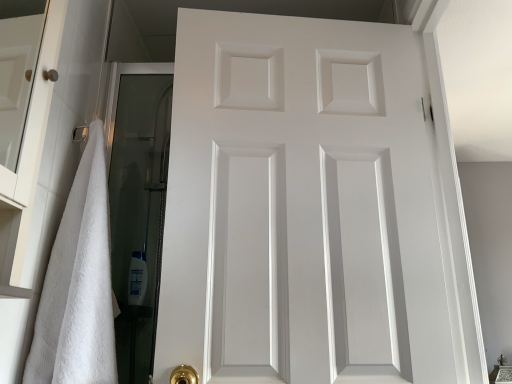
This screenshot has width=512, height=384. What do you see at coordinates (78, 285) in the screenshot?
I see `white fluffy towel at left` at bounding box center [78, 285].

Where is `white glossy shampoo bottle at lower left`? white glossy shampoo bottle at lower left is located at coordinates (137, 278).

This screenshot has height=384, width=512. What do you see at coordinates (137, 278) in the screenshot? I see `white glossy shampoo bottle at lower left` at bounding box center [137, 278].

At what (x,y) coordinates should I click in order to perform the action: click on white fluffy towel at left. Please return your answer as a coordinate pair (x, y). The image size is (512, 384). Looking at the image, I should click on (78, 285).

How many degrees apart are the facing directions of white glossy shampoo bottle at lower left and white matte door at center?

There is a 81.6-degree angle between the facing directions of white glossy shampoo bottle at lower left and white matte door at center.

How distant is white glossy shampoo bottle at lower left from white matte door at center?

white glossy shampoo bottle at lower left is 33.00 inches away from white matte door at center.

Is white glossy shampoo bottle at lower left to the left or to the right of white matte door at center in the image?

Based on their positions, white glossy shampoo bottle at lower left is located to the left of white matte door at center.

Can you confirm if white glossy shampoo bottle at lower left is shorter than white matte door at center?

Yes.

Is white fluffy towel at left facing away from white matte door at center?

No, white fluffy towel at left is not facing the opposite direction of white matte door at center.

Which object is wider, white fluffy towel at left or white matte door at center?

white fluffy towel at left is wider.

Is white fluffy towel at left smaller than white matte door at center?

Correct, white fluffy towel at left occupies less space than white matte door at center.

Find the location of a particular element. bath towel located in front of the white matte door at center is located at coordinates (78, 285).

Is white glossy shampoo bottle at lower left positioned far away from white fluffy towel at left?

No.

Considering the positions of point (133, 257) and point (106, 319), is point (133, 257) closer or farther from the camera than point (106, 319)?

Point (133, 257) is positioned farther from the camera compared to point (106, 319).

Where is `toiletry below the white fluffy towel at left (from the image's perspective)`? The image size is (512, 384). toiletry below the white fluffy towel at left (from the image's perspective) is located at coordinates (137, 278).

Looking at their sizes, would you say white glossy shampoo bottle at lower left is wider or thinner than white fluffy towel at left?

white glossy shampoo bottle at lower left is thinner than white fluffy towel at left.

From the image's perspective, between white matte door at center and white fluffy towel at left, which one is located above?

white matte door at center, from the image's perspective.

Does white matte door at center appear on the left side of white fluffy towel at left?

In fact, white matte door at center is to the right of white fluffy towel at left.

How different are the orientations of white matte door at center and white fluffy towel at left in degrees?

white matte door at center and white fluffy towel at left are facing 86.3 degrees away from each other.

Would you consider white matte door at center to be distant from white fluffy towel at left?

No, white matte door at center is in close proximity to white fluffy towel at left.

Who is bigger, white matte door at center or white glossy shampoo bottle at lower left?

Bigger between the two is white matte door at center.

From the picture: Measure the distance from white matte door at center to white glossy shampoo bottle at lower left.

white matte door at center and white glossy shampoo bottle at lower left are 33.00 inches apart from each other.

Where is `toiletry that is behind the white matte door at center`? This screenshot has width=512, height=384. toiletry that is behind the white matte door at center is located at coordinates (137, 278).

Is white matte door at center positioned beyond the bounds of white glossy shampoo bottle at lower left?

white matte door at center is positioned outside white glossy shampoo bottle at lower left.

Consider the image. Considering the relative positions of white fluffy towel at left and white glossy shampoo bottle at lower left in the image provided, is white fluffy towel at left to the left of white glossy shampoo bottle at lower left from the viewer's perspective?

In fact, white fluffy towel at left is to the right of white glossy shampoo bottle at lower left.

Considering the positions of objects white fluffy towel at left and white glossy shampoo bottle at lower left in the image provided, who is behind, white fluffy towel at left or white glossy shampoo bottle at lower left?

white glossy shampoo bottle at lower left is further away from the camera.

The image size is (512, 384). Identify the location of toiletry behind the white fluffy towel at left. (137, 278).

Based on the photo, from the image's perspective, which one is positioned higher, white fluffy towel at left or white glossy shampoo bottle at lower left?

From the image's view, white fluffy towel at left is above.

Image resolution: width=512 pixels, height=384 pixels. In order to click on toiletry below the white matte door at center (from a real-world perspective) in this screenshot , I will do `click(137, 278)`.

Identify the location of door behind the white fluffy towel at left. (307, 198).

Looking at the image, which one is located further to white fluffy towel at left, white matte door at center or white glossy shampoo bottle at lower left?

white glossy shampoo bottle at lower left.

Looking at the image, which one is located closer to white glossy shampoo bottle at lower left, white fluffy towel at left or white matte door at center?

Among the two, white fluffy towel at left is located nearer to white glossy shampoo bottle at lower left.

When comparing their distances from white matte door at center, does white glossy shampoo bottle at lower left or white fluffy towel at left seem further?

Based on the image, white glossy shampoo bottle at lower left appears to be further to white matte door at center.

Looking at the image, which one is located closer to white glossy shampoo bottle at lower left, white matte door at center or white fluffy towel at left?

white fluffy towel at left lies closer to white glossy shampoo bottle at lower left than the other object.

When comparing their distances from white fluffy towel at left, does white glossy shampoo bottle at lower left or white matte door at center seem closer?

white matte door at center lies closer to white fluffy towel at left than the other object.

Looking at the image, which one is located closer to white matte door at center, white fluffy towel at left or white glossy shampoo bottle at lower left?

white fluffy towel at left lies closer to white matte door at center than the other object.

At what (x,y) coordinates should I click in order to perform the action: click on door between white fluffy towel at left and white glossy shampoo bottle at lower left along the z-axis. Please return your answer as a coordinate pair (x, y). Looking at the image, I should click on (307, 198).